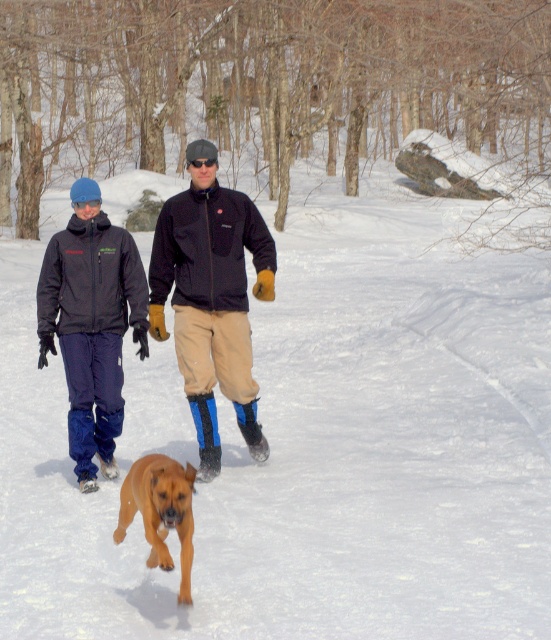
Who is higher up, khaki pants at center or matte black jacket at left?

khaki pants at center is higher up.

Is khaki pants at center shorter than matte black jacket at left?

Incorrect, khaki pants at center's height does not fall short of matte black jacket at left's.

Is point (177, 304) closer to camera compared to point (69, 305)?

No, it is behind (69, 305).

Find the location of `khaki pants at center`. khaki pants at center is located at coordinates (212, 298).

Who is lower down, khaki pants at center or golden brown fur at center?

Positioned lower is golden brown fur at center.

The width and height of the screenshot is (551, 640). Describe the element at coordinates (212, 298) in the screenshot. I see `khaki pants at center` at that location.

Image resolution: width=551 pixels, height=640 pixels. I want to click on khaki pants at center, so click(x=212, y=298).

Is matte black jacket at left below golden brown fur at center?

No.

Which is in front, point (134, 250) or point (121, 522)?

Point (121, 522) is more forward.

Image resolution: width=551 pixels, height=640 pixels. Describe the element at coordinates (91, 323) in the screenshot. I see `matte black jacket at left` at that location.

You are a GUI agent. You are given a task and a screenshot of the screen. Output one action in this format:
    pyautogui.click(x=<x>, y=<y>)
    Task: Click on the matte black jacket at left
    The height and width of the screenshot is (640, 551).
    Given the screenshot: What is the action you would take?
    click(x=91, y=323)